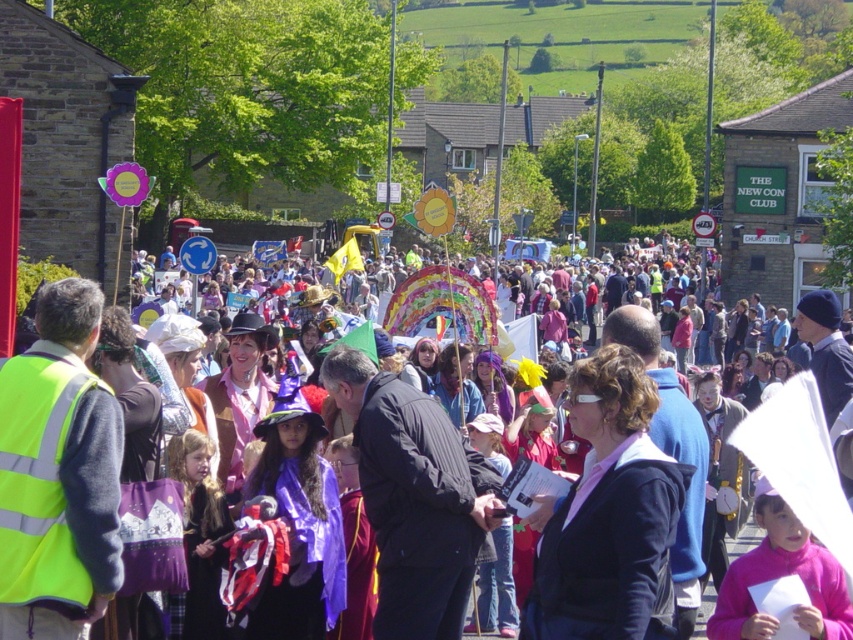
Does matte purple costume at center appear over pink fabric at center?

Indeed, matte purple costume at center is positioned over pink fabric at center.

Looking at this image, between matte purple costume at center and pink fabric at center, which one has less height?

With less height is pink fabric at center.

Find the location of `matte purple costume at center`. matte purple costume at center is located at coordinates (724, 403).